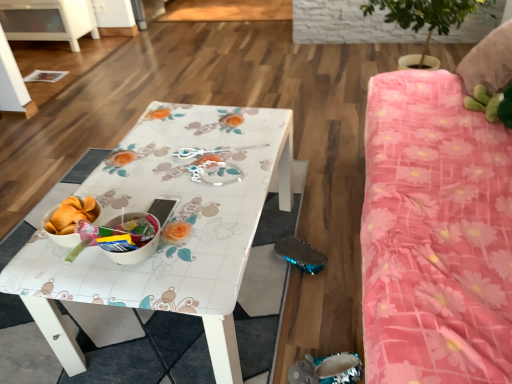
Where is `vacant space situated on the left part of clear plastic spoon at center`? vacant space situated on the left part of clear plastic spoon at center is located at coordinates (164, 154).